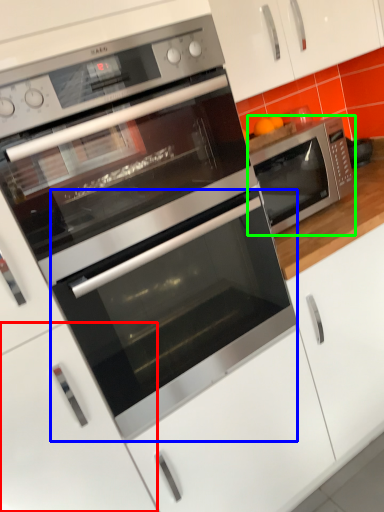
Question: Considering the real-world distances, which object is farthest from drawer (highlighted by a red box)? oven (highlighted by a blue box) or microwave oven (highlighted by a green box)?

Choices:
 (A) oven
 (B) microwave oven

Answer: (B)